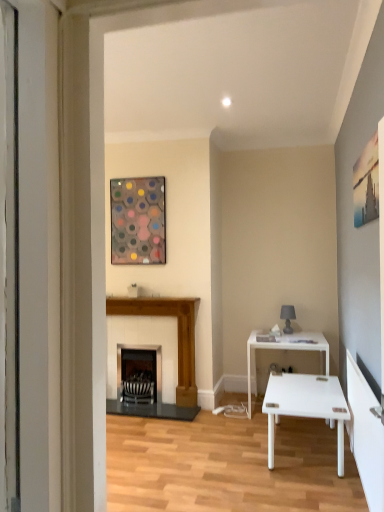
The height and width of the screenshot is (512, 384). What do you see at coordinates (178, 335) in the screenshot?
I see `wooden fireplace at center, which is counted as the 1th fireplace, starting from the right` at bounding box center [178, 335].

Find the location of a particular element. Image resolution: width=384 pixels, height=512 pixels. metallic hexagonal artwork at upper center is located at coordinates (138, 221).

In order to face white glossy table at right, should I rotate leftwards or rightwards?

Turn right approximately 13.059 degrees to face it.

Find the location of `matte gray lampshade at right`. matte gray lampshade at right is located at coordinates (287, 317).

What do you see at coordinates (287, 317) in the screenshot? The width and height of the screenshot is (384, 512). I see `matte gray lampshade at right` at bounding box center [287, 317].

Locate an element on the screen. wooden fireplace at center, arranged as the 2th fireplace when viewed from the left is located at coordinates (178, 335).

From the picture: Which is correct: white glossy table at right is inside black striped fireplace at center, the first fireplace positioned from the left, or outside of it?

The correct answer is: outside.

In the scene shown: From the image's perspective, which is below, white glossy table at right or black striped fireplace at center, acting as the second fireplace starting from the right?

From the image's view, black striped fireplace at center, acting as the second fireplace starting from the right, is below.

Is white glossy table at right facing towards black striped fireplace at center, the first fireplace positioned from the left?

No, white glossy table at right is not aimed at black striped fireplace at center, the first fireplace positioned from the left.

Is white glossy table at right bigger than black striped fireplace at center, the first fireplace positioned from the left?

Yes, white glossy table at right is bigger than black striped fireplace at center, the first fireplace positioned from the left.

Where is `lamp behind the black striped fireplace at center, acting as the second fireplace starting from the right`? The width and height of the screenshot is (384, 512). lamp behind the black striped fireplace at center, acting as the second fireplace starting from the right is located at coordinates (287, 317).

Is matte gray lampshade at right positioned with its back to black striped fireplace at center, acting as the second fireplace starting from the right?

No.

Consider the image. Considering the positions of objects matte gray lampshade at right and black striped fireplace at center, the first fireplace positioned from the left, in the image provided, who is more to the left, matte gray lampshade at right or black striped fireplace at center, the first fireplace positioned from the left,?

black striped fireplace at center, the first fireplace positioned from the left, is more to the left.

Does point (132, 360) come closer to viewer compared to point (153, 304)?

That is False.

Which is more to the left, black striped fireplace at center, the first fireplace positioned from the left, or wooden fireplace at center, arranged as the 2th fireplace when viewed from the left?

Positioned to the left is black striped fireplace at center, the first fireplace positioned from the left.

Would you say black striped fireplace at center, acting as the second fireplace starting from the right, is outside wooden fireplace at center, which is counted as the 1th fireplace, starting from the right?

No.

Is black striped fireplace at center, acting as the second fireplace starting from the right, turned away from wooden fireplace at center, arranged as the 2th fireplace when viewed from the left?

Yes, wooden fireplace at center, arranged as the 2th fireplace when viewed from the left, is at the back of black striped fireplace at center, acting as the second fireplace starting from the right.

Which is more to the left, matte gray lampshade at right or wooden fireplace at center, which is counted as the 1th fireplace, starting from the right?

Positioned to the left is wooden fireplace at center, which is counted as the 1th fireplace, starting from the right.

Looking at this image, from the image's perspective, between matte gray lampshade at right and wooden fireplace at center, which is counted as the 1th fireplace, starting from the right, who is located below?

From the image's view, wooden fireplace at center, which is counted as the 1th fireplace, starting from the right, is below.

What's the angular difference between matte gray lampshade at right and wooden fireplace at center, arranged as the 2th fireplace when viewed from the left,'s facing directions?

The facing directions of matte gray lampshade at right and wooden fireplace at center, arranged as the 2th fireplace when viewed from the left, are 0.00103 degrees apart.

In order to click on table on the left of matte gray lampshade at right in this screenshot , I will do `click(288, 350)`.

Is white glossy table at right completely or partially inside matte gray lampshade at right?

No, white glossy table at right is not a part of matte gray lampshade at right.

Is point (288, 331) positioned after point (271, 347)?

Yes, point (288, 331) is farther from viewer.

Considering the relative sizes of wooden fireplace at center, arranged as the 2th fireplace when viewed from the left, and white glossy table at right in the image provided, is wooden fireplace at center, arranged as the 2th fireplace when viewed from the left, taller than white glossy table at right?

Yes.

Does wooden fireplace at center, arranged as the 2th fireplace when viewed from the left, come behind white glossy table at right?

Yes.

Identify the location of table on the right of the wooden fireplace at center, which is counted as the 1th fireplace, starting from the right. Image resolution: width=384 pixels, height=512 pixels. 288,350.

Is wooden fireplace at center, arranged as the 2th fireplace when viewed from the left, facing away from white glossy table at right?

No, wooden fireplace at center, arranged as the 2th fireplace when viewed from the left,'s orientation is not away from white glossy table at right.

Identify the location of picture frame located on the left of wooden fireplace at center, arranged as the 2th fireplace when viewed from the left. (138, 221).

Is metallic hexagonal artwork at upper center taller or shorter than wooden fireplace at center, which is counted as the 1th fireplace, starting from the right?

Considering their sizes, metallic hexagonal artwork at upper center has less height than wooden fireplace at center, which is counted as the 1th fireplace, starting from the right.

Is metallic hexagonal artwork at upper center at the left side of wooden fireplace at center, which is counted as the 1th fireplace, starting from the right?

Indeed, metallic hexagonal artwork at upper center is positioned on the left side of wooden fireplace at center, which is counted as the 1th fireplace, starting from the right.

Locate an element on the screen. This screenshot has width=384, height=512. fireplace below the white glossy table at right (from the image's perspective) is located at coordinates (140, 365).

This screenshot has width=384, height=512. Find the location of `the 2nd fireplace to the left of the matte gray lampshade at right, counting from the anchor's position`. the 2nd fireplace to the left of the matte gray lampshade at right, counting from the anchor's position is located at coordinates (140, 365).

Which object lies nearer to the anchor point white glossy table at right, matte gray lampshade at right or black striped fireplace at center, acting as the second fireplace starting from the right?

matte gray lampshade at right is closer to white glossy table at right.

Which object lies nearer to the anchor point white glossy table at right, matte gray lampshade at right or metallic hexagonal artwork at upper center?

matte gray lampshade at right lies closer to white glossy table at right than the other object.

From the image, which object appears to be farther from black striped fireplace at center, acting as the second fireplace starting from the right, metallic hexagonal artwork at upper center or matte gray lampshade at right?

Among the two, matte gray lampshade at right is located further to black striped fireplace at center, acting as the second fireplace starting from the right.

Looking at this image, considering their positions, is wooden fireplace at center, arranged as the 2th fireplace when viewed from the left, positioned closer to metallic hexagonal artwork at upper center than matte gray lampshade at right?

The object closer to metallic hexagonal artwork at upper center is wooden fireplace at center, arranged as the 2th fireplace when viewed from the left.

From the image, which object appears to be nearer to matte gray lampshade at right, wooden fireplace at center, arranged as the 2th fireplace when viewed from the left, or metallic hexagonal artwork at upper center?

wooden fireplace at center, arranged as the 2th fireplace when viewed from the left, is positioned closer to the anchor matte gray lampshade at right.

Looking at the image, which one is located closer to wooden fireplace at center, which is counted as the 1th fireplace, starting from the right, black striped fireplace at center, the first fireplace positioned from the left, or metallic hexagonal artwork at upper center?

black striped fireplace at center, the first fireplace positioned from the left, is closer to wooden fireplace at center, which is counted as the 1th fireplace, starting from the right.

When comparing their distances from metallic hexagonal artwork at upper center, does matte gray lampshade at right or black striped fireplace at center, the first fireplace positioned from the left, seem further?

matte gray lampshade at right is further to metallic hexagonal artwork at upper center.

Looking at the image, which one is located closer to white glossy table at right, black striped fireplace at center, the first fireplace positioned from the left, or metallic hexagonal artwork at upper center?

The object closer to white glossy table at right is black striped fireplace at center, the first fireplace positioned from the left.

Image resolution: width=384 pixels, height=512 pixels. What are the coordinates of `table between black striped fireplace at center, the first fireplace positioned from the left, and matte gray lampshade at right` in the screenshot? It's located at (288, 350).

Where is `fireplace between black striped fireplace at center, the first fireplace positioned from the left, and white glossy table at right from left to right`? This screenshot has width=384, height=512. fireplace between black striped fireplace at center, the first fireplace positioned from the left, and white glossy table at right from left to right is located at coordinates (178, 335).

The height and width of the screenshot is (512, 384). I want to click on table between metallic hexagonal artwork at upper center and black striped fireplace at center, the first fireplace positioned from the left, in the vertical direction, so click(x=288, y=350).

This screenshot has width=384, height=512. I want to click on fireplace between black striped fireplace at center, acting as the second fireplace starting from the right, and matte gray lampshade at right from left to right, so coord(178,335).